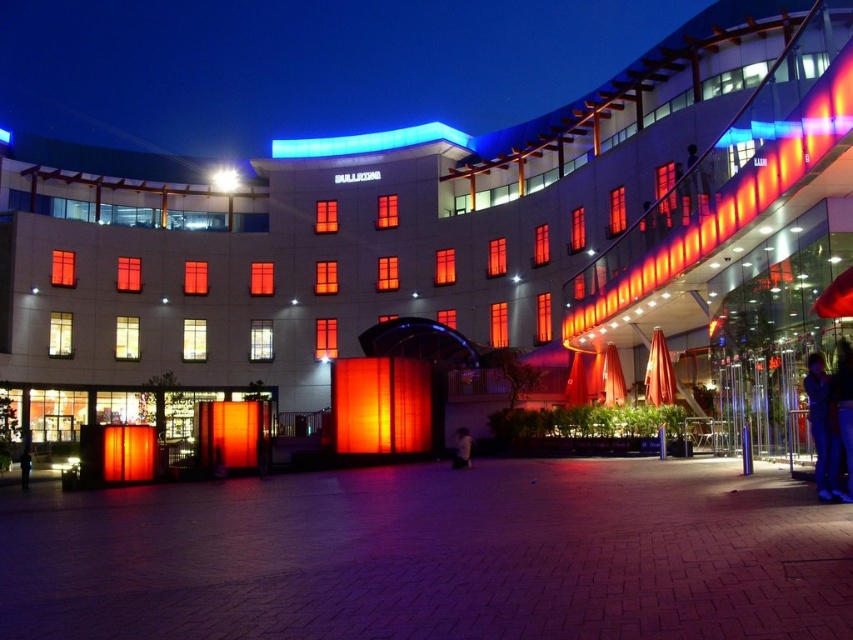
You are standing at the point labeled point (24,484) and want to walk to the entrance of the building. You see the point labeled point (822,490). Which direction should you walk relative to that point to reach the entrance?

Since point (822,490) is in front of point (24,484), you should walk towards the building entrance by moving away from point (822,490) in the opposite direction.

You are standing at the entrance of the building and want to move from the blue jeans at lower right to the dark blue jeans at lower left. Given that your walking path is 200 feet long, will you be able to reach the dark blue jeans without deviating from the path?

The blue jeans at lower right and dark blue jeans at lower left are 205.11 feet apart. Since your path is only 200 feet long, you will not be able to reach the dark blue jeans without deviating from the path.

You are standing at the entrance of the modern building and want to locate the matte orange neon at upper right. According to the coordinates provided, where should you look relative to your position?

The matte orange neon at upper right is located at coordinates point (732, 200), which means it is positioned to the upper right relative to your viewpoint.